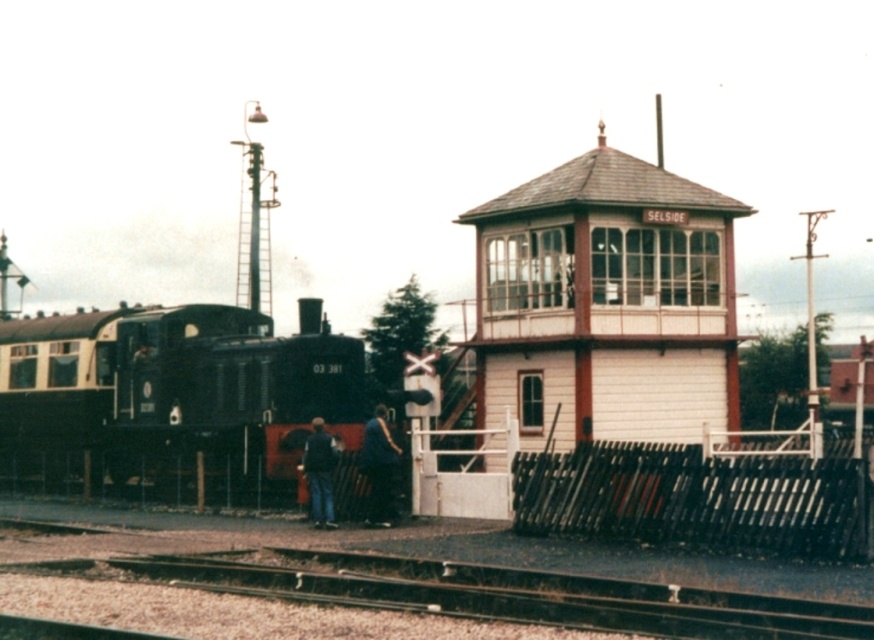
You are observing a railway scene with a signal box and a steam locomotive. You notice a dark blue shirt at center and a matte black locomotive at left. From your perspective, which object is closer to you?

The dark blue shirt at center is behind the matte black locomotive at left, so the matte black locomotive at left is closer to you.

Based on the coordinates provided, where is the white wooden signal box at center located in the image?

The white wooden signal box at center is located at coordinates point (591, 321).